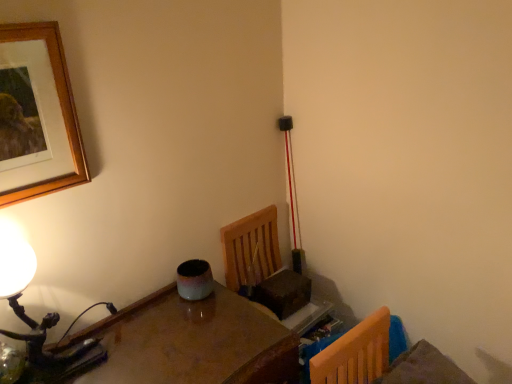
Where is `glossy wooden table at lower left`? glossy wooden table at lower left is located at coordinates (190, 342).

Locate an element on the screen. wooden picture frame at upper left is located at coordinates (37, 115).

Where is `matte black table lamp at left`? This screenshot has width=512, height=384. matte black table lamp at left is located at coordinates (35, 321).

The width and height of the screenshot is (512, 384). Find the location of `glossy wooden table at lower left`. glossy wooden table at lower left is located at coordinates (190, 342).

Does point (23, 99) come farther from viewer compared to point (16, 299)?

No, it is not.

Is wooden picture frame at upper left wider or thinner than matte black table lamp at left?

wooden picture frame at upper left is thinner than matte black table lamp at left.

How many degrees apart are the facing directions of wooden picture frame at upper left and matte black table lamp at left?

2 degrees separate the facing orientations of wooden picture frame at upper left and matte black table lamp at left.

From the image's perspective, is wooden picture frame at upper left located above matte black table lamp at left?

Correct, wooden picture frame at upper left appears higher than matte black table lamp at left in the image.

Can you confirm if glossy wooden table at lower left is thinner than wooden picture frame at upper left?

No, glossy wooden table at lower left is not thinner than wooden picture frame at upper left.

Is glossy wooden table at lower left far from wooden picture frame at upper left?

No, glossy wooden table at lower left is in close proximity to wooden picture frame at upper left.

Which is in front, glossy wooden table at lower left or wooden picture frame at upper left?

glossy wooden table at lower left is in front.

Is glossy wooden table at lower left to the left or to the right of wooden picture frame at upper left in the image?

In the image, glossy wooden table at lower left appears on the right side of wooden picture frame at upper left.

From a real-world perspective, is wooden picture frame at upper left physically located above or below glossy wooden table at lower left?

Clearly, from a real-world perspective, wooden picture frame at upper left is above glossy wooden table at lower left.

Consider the image. Can you confirm if wooden picture frame at upper left is bigger than glossy wooden table at lower left?

No.

Consider the image. Considering the relative sizes of wooden picture frame at upper left and glossy wooden table at lower left in the image provided, is wooden picture frame at upper left wider than glossy wooden table at lower left?

No, wooden picture frame at upper left is not wider than glossy wooden table at lower left.

Which point is more forward, (60, 129) or (169, 319)?

Positioned in front is point (60, 129).

How different are the orientations of glossy wooden table at lower left and matte black table lamp at left in degrees?

0.273 degrees separate the facing orientations of glossy wooden table at lower left and matte black table lamp at left.

From the image's perspective, is glossy wooden table at lower left positioned above or below matte black table lamp at left?

From the image's perspective, glossy wooden table at lower left appears below matte black table lamp at left.

From a real-world perspective, is glossy wooden table at lower left positioned under matte black table lamp at left based on gravity?

Correct, in the physical world, glossy wooden table at lower left is lower than matte black table lamp at left.

Is glossy wooden table at lower left at the back of matte black table lamp at left?

No.

Is matte black table lamp at left in contact with glossy wooden table at lower left?

No, matte black table lamp at left is not beside glossy wooden table at lower left.

Who is shorter, matte black table lamp at left or glossy wooden table at lower left?

With less height is matte black table lamp at left.

Locate an element on the screen. The width and height of the screenshot is (512, 384). table below the matte black table lamp at left (from the image's perspective) is located at coordinates (190, 342).

Considering the positions of objects matte black table lamp at left and wooden picture frame at upper left in the image provided, who is in front, matte black table lamp at left or wooden picture frame at upper left?

wooden picture frame at upper left is more forward.

Which is closer to the camera, (46,374) or (46,175)?

Clearly, point (46,374) is more distant from the camera than point (46,175).

Considering the relative sizes of matte black table lamp at left and wooden picture frame at upper left in the image provided, is matte black table lamp at left thinner than wooden picture frame at upper left?

In fact, matte black table lamp at left might be wider than wooden picture frame at upper left.

From the image's perspective, which is below, matte black table lamp at left or wooden picture frame at upper left?

matte black table lamp at left appears lower in the image.

This screenshot has width=512, height=384. In order to click on table lamp below the wooden picture frame at upper left (from the image's perspective) in this screenshot , I will do `click(35, 321)`.

This screenshot has width=512, height=384. In order to click on picture frame that appears above the glossy wooden table at lower left (from the image's perspective) in this screenshot , I will do `click(37, 115)`.

Considering their positions, is matte black table lamp at left positioned further to glossy wooden table at lower left than wooden picture frame at upper left?

wooden picture frame at upper left is further to glossy wooden table at lower left.

Looking at the image, which one is located closer to glossy wooden table at lower left, wooden picture frame at upper left or matte black table lamp at left?

matte black table lamp at left is positioned closer to the anchor glossy wooden table at lower left.

Looking at this image, from the image, which object appears to be farther from wooden picture frame at upper left, matte black table lamp at left or glossy wooden table at lower left?

glossy wooden table at lower left is positioned further to the anchor wooden picture frame at upper left.

Considering their positions, is glossy wooden table at lower left positioned further to wooden picture frame at upper left than matte black table lamp at left?

glossy wooden table at lower left.

From the picture: From the image, which object appears to be farther from matte black table lamp at left, glossy wooden table at lower left or wooden picture frame at upper left?

Among the two, wooden picture frame at upper left is located further to matte black table lamp at left.

From the image, which object appears to be nearer to matte black table lamp at left, wooden picture frame at upper left or glossy wooden table at lower left?

glossy wooden table at lower left is positioned closer to the anchor matte black table lamp at left.

Where is `table lamp that lies between wooden picture frame at upper left and glossy wooden table at lower left from top to bottom`? table lamp that lies between wooden picture frame at upper left and glossy wooden table at lower left from top to bottom is located at coordinates (35, 321).